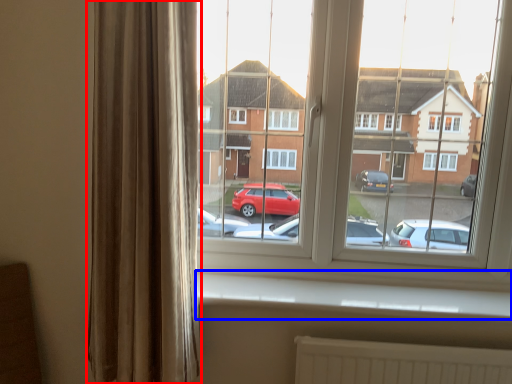
Question: Among these objects, which one is farthest to the camera, curtain (highlighted by a red box) or window sill (highlighted by a blue box)?

Choices:
 (A) curtain
 (B) window sill

Answer: (B)